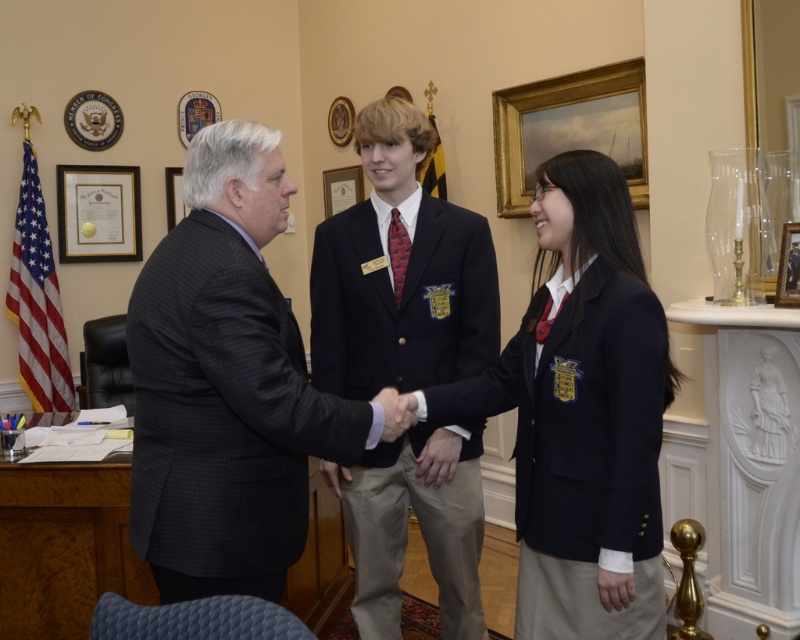
Is gold-framed certificate at upper left taller than matte gold picture frame at center?

Correct, gold-framed certificate at upper left is much taller as matte gold picture frame at center.

In the scene shown: Is gold-framed certificate at upper left smaller than matte gold picture frame at center?

Actually, gold-framed certificate at upper left might be larger than matte gold picture frame at center.

The image size is (800, 640). In order to click on gold-framed certificate at upper left in this screenshot , I will do (x=98, y=212).

This screenshot has width=800, height=640. I want to click on gold-framed certificate at upper left, so click(x=98, y=212).

Who is positioned more to the right, navy blue blazer at center or matte gold picture frame at center?

navy blue blazer at center is more to the right.

Who is taller, navy blue blazer at center or matte gold picture frame at center?

With more height is navy blue blazer at center.

Which is behind, point (572, 410) or point (330, 205)?

Point (330, 205)

The image size is (800, 640). What are the coordinates of `navy blue blazer at center` in the screenshot? It's located at (582, 413).

How much distance is there between dark gray suit at center and red textured tie at center?

dark gray suit at center and red textured tie at center are 32.47 inches apart.

Which is below, dark gray suit at center or red textured tie at center?

Positioned lower is dark gray suit at center.

Is point (165, 598) positioned behind point (402, 225)?

No, (165, 598) is closer to viewer.

In order to click on dark gray suit at center in this screenshot , I will do `click(228, 385)`.